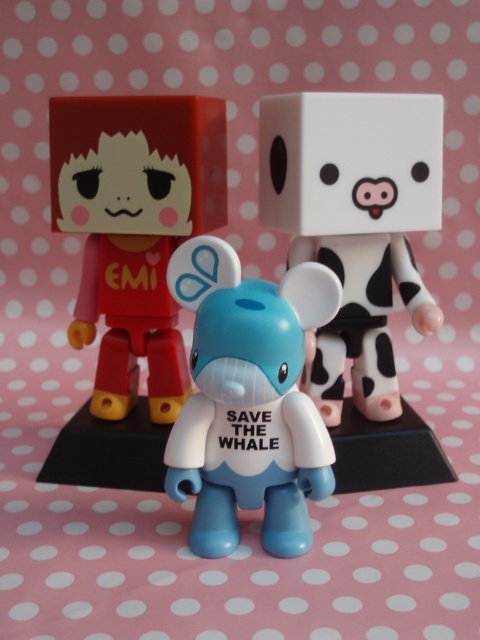
Question: Estimate the real-world distances between objects in this image. Which object is closer to the matte red cube at left?

Choices:
 (A) white matte cube at center
 (B) blue matte toy at center

Answer: (A)

Question: Is matte red cube at left further to camera compared to blue matte toy at center?

Choices:
 (A) yes
 (B) no

Answer: (A)

Question: Which point is closer to the camera?

Choices:
 (A) (162, 132)
 (B) (382, 396)
 (C) (244, 360)

Answer: (C)

Question: Can you confirm if matte red cube at left is positioned to the right of blue matte toy at center?

Choices:
 (A) yes
 (B) no

Answer: (B)

Question: Which object is closer to the camera taking this photo?

Choices:
 (A) white matte cube at center
 (B) matte red cube at left
 (C) blue matte toy at center

Answer: (C)

Question: Is matte red cube at left behind blue matte toy at center?

Choices:
 (A) yes
 (B) no

Answer: (A)